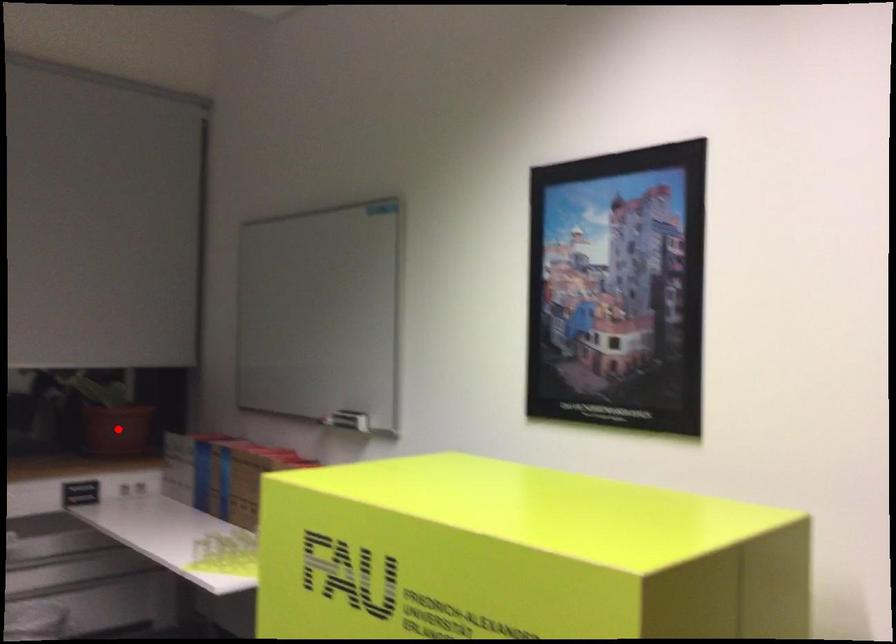
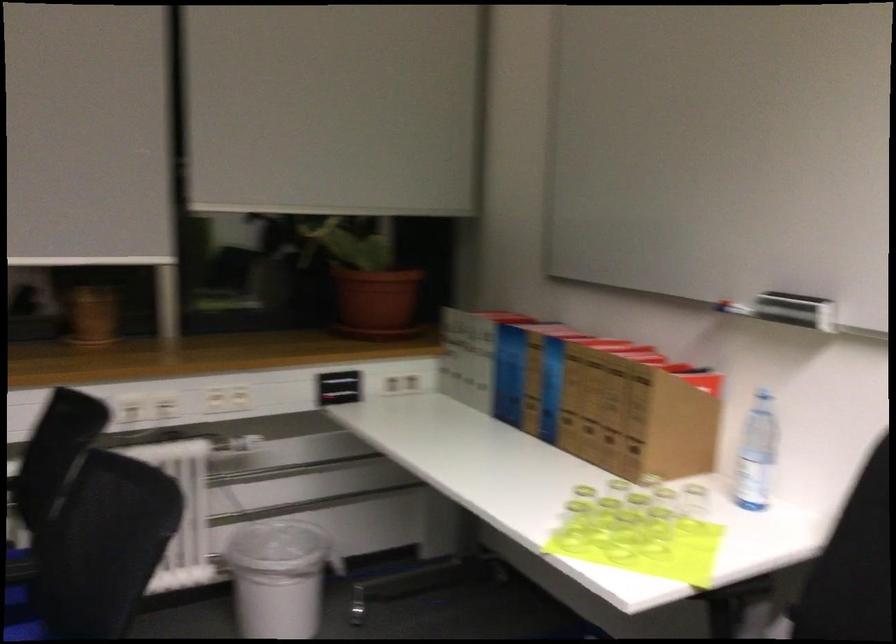
Question: I am providing you with two images of the same scene from different viewpoints. Image1 has a red point marked. In image2, the corresponding 3D location appears at what relative position? Reply with the corresponding letter.

Choices:
 (A) Closer
 (B) Farther

Answer: (A)